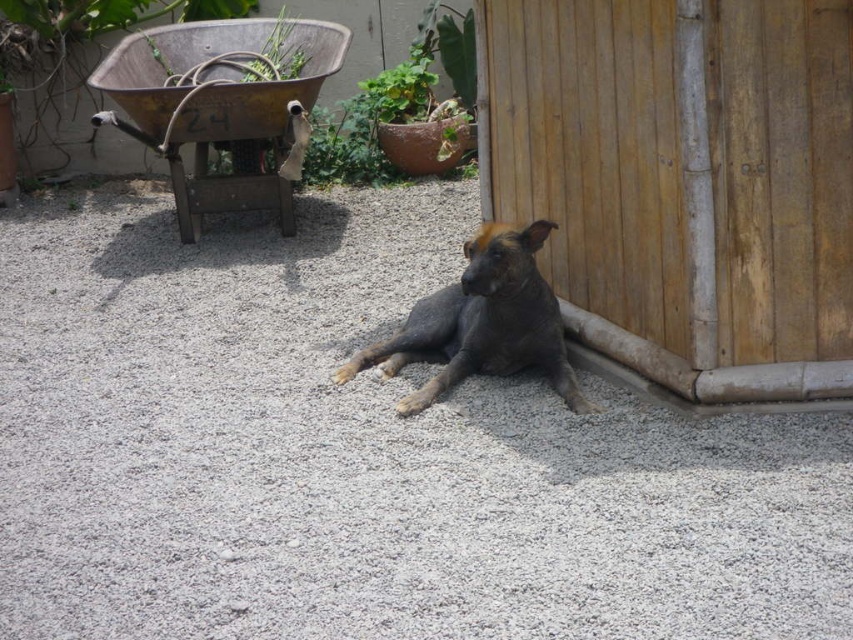
Does gray gravel at center have a lesser height compared to dark gray fur dog at center?

Incorrect, gray gravel at center's height does not fall short of dark gray fur dog at center's.

Which is below, gray gravel at center or dark gray fur dog at center?

gray gravel at center

Is point (289, 444) in front of point (463, 292)?

Yes, it is.

Locate an element on the screen. The height and width of the screenshot is (640, 853). gray gravel at center is located at coordinates (361, 452).